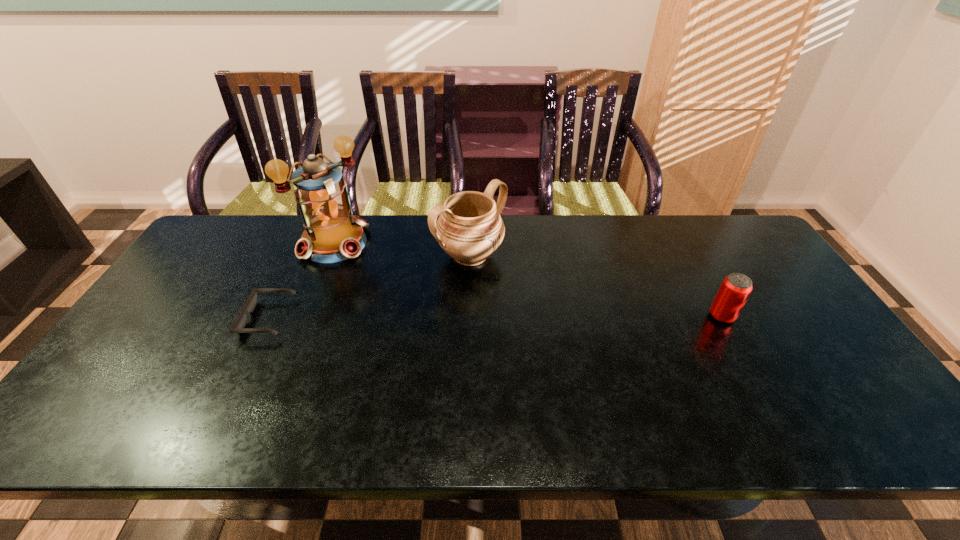
Locate an element on the screen. This screenshot has width=960, height=540. vacant point located between the lantern and the sunglasses is located at coordinates (301, 281).

Find the location of a particular element. free area in between the shortest object and the tallest object is located at coordinates (301, 281).

This screenshot has width=960, height=540. I want to click on the closest object to the third object from left to right, so click(x=332, y=233).

You are a GUI agent. You are given a task and a screenshot of the screen. Output one action in this format:
    pyautogui.click(x=<x>, y=<y>)
    Task: Click on the object that ranks as the second closest to the urn
    The image size is (960, 540).
    Given the screenshot: What is the action you would take?
    pyautogui.click(x=238, y=327)

This screenshot has width=960, height=540. What are the coordinates of `vacant space that satisfies the following two spatial constraints: 1. on the front side of the lantern; 2. on the left side of the second tallest object` in the screenshot? It's located at (330, 255).

At what (x,y) coordinates should I click in order to perform the action: click on free space that satisfies the following two spatial constraints: 1. on the front side of the lantern; 2. on the left side of the third tallest object. Please return your answer as a coordinate pair (x, y). Looking at the image, I should click on (305, 316).

Locate an element on the screen. This screenshot has width=960, height=540. free space that satisfies the following two spatial constraints: 1. on the front side of the third object from left to right; 2. on the right side of the rightmost object is located at coordinates (468, 316).